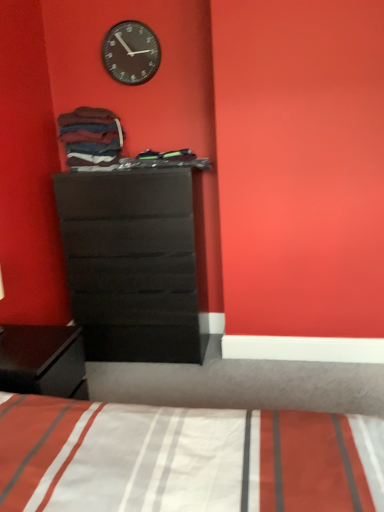
Question: Can you confirm if matte black dresser at center is positioned to the right of dark brown cotton socks at upper left?

Choices:
 (A) yes
 (B) no

Answer: (A)

Question: Would you consider matte black dresser at center to be distant from dark brown cotton socks at upper left?

Choices:
 (A) yes
 (B) no

Answer: (B)

Question: Is matte black dresser at center in front of dark brown cotton socks at upper left?

Choices:
 (A) no
 (B) yes

Answer: (B)

Question: From the image's perspective, is matte black dresser at center on top of dark brown cotton socks at upper left?

Choices:
 (A) yes
 (B) no

Answer: (B)

Question: Could you tell me if matte black dresser at center is turned towards dark brown cotton socks at upper left?

Choices:
 (A) yes
 (B) no

Answer: (B)

Question: Can you confirm if matte black dresser at center is positioned to the left of dark brown cotton socks at upper left?

Choices:
 (A) yes
 (B) no

Answer: (B)

Question: Is black matte clock at upper center positioned behind dark brown cotton socks at upper left?

Choices:
 (A) yes
 (B) no

Answer: (A)

Question: Is black matte clock at upper center at the left side of dark brown cotton socks at upper left?

Choices:
 (A) no
 (B) yes

Answer: (A)

Question: Does black matte clock at upper center have a greater width compared to dark brown cotton socks at upper left?

Choices:
 (A) no
 (B) yes

Answer: (A)

Question: Is black matte clock at upper center looking in the opposite direction of dark brown cotton socks at upper left?

Choices:
 (A) no
 (B) yes

Answer: (A)

Question: Can you confirm if black matte clock at upper center is positioned to the right of dark brown cotton socks at upper left?

Choices:
 (A) yes
 (B) no

Answer: (A)

Question: From the image's perspective, is black matte clock at upper center on top of dark brown cotton socks at upper left?

Choices:
 (A) no
 (B) yes

Answer: (B)

Question: From the image's perspective, does black matte clock at upper center appear lower than matte black dresser at center?

Choices:
 (A) no
 (B) yes

Answer: (A)